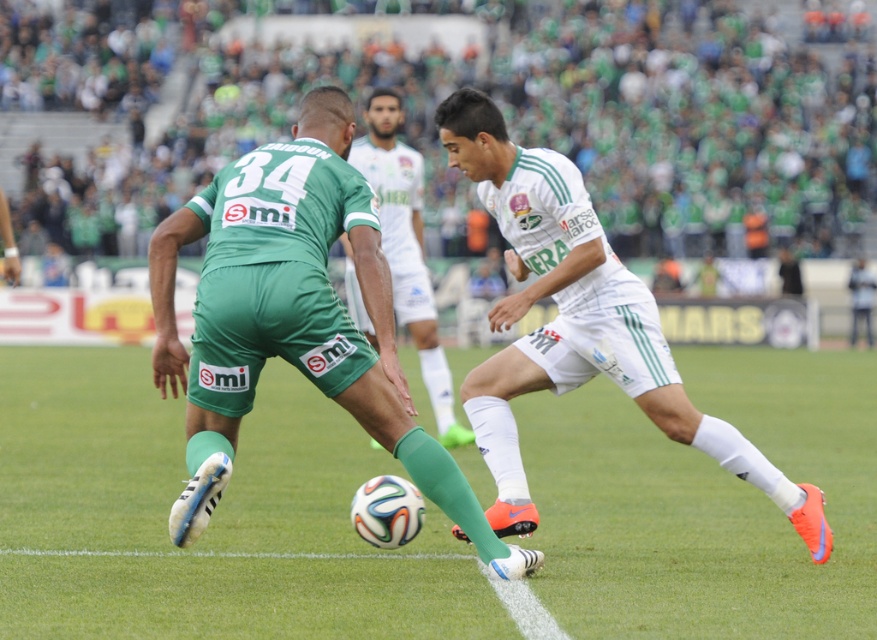
Between green grass football field at center and white matte shorts at center, which one has more height?

Standing taller between the two is white matte shorts at center.

Which is below, green grass football field at center or white matte shorts at center?

Positioned lower is green grass football field at center.

You are a GUI agent. You are given a task and a screenshot of the screen. Output one action in this format:
    pyautogui.click(x=<x>, y=<y>)
    Task: Click on the green grass football field at center
    The width and height of the screenshot is (877, 640).
    Given the screenshot: What is the action you would take?
    pyautogui.click(x=706, y=502)

You are a GUI agent. You are given a task and a screenshot of the screen. Output one action in this format:
    pyautogui.click(x=<x>, y=<y>)
    Task: Click on the green grass football field at center
    Image resolution: width=877 pixels, height=640 pixels.
    Given the screenshot: What is the action you would take?
    pyautogui.click(x=706, y=502)

Between matte green jersey at center and white matte shorts at center, which one is positioned lower?

white matte shorts at center

Does matte green jersey at center have a lesser height compared to white matte shorts at center?

Yes.

Who is more distant from viewer, (215, 419) or (564, 381)?

The point (564, 381) is more distant.

Locate an element on the screen. matte green jersey at center is located at coordinates (293, 317).

Is green grass football field at center below matte green jersey at center?

Yes, green grass football field at center is below matte green jersey at center.

Is green grass football field at center bigger than matte green jersey at center?

Yes, green grass football field at center is bigger than matte green jersey at center.

Who is more forward, [437,618] or [223,212]?

Point [437,618] is in front.

Where is `green grass football field at center`? The height and width of the screenshot is (640, 877). green grass football field at center is located at coordinates (706, 502).